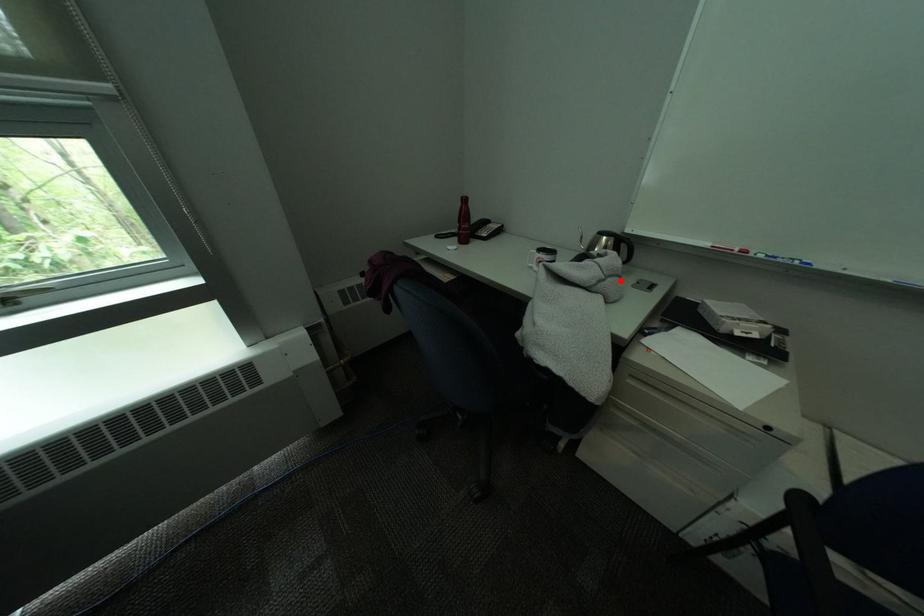
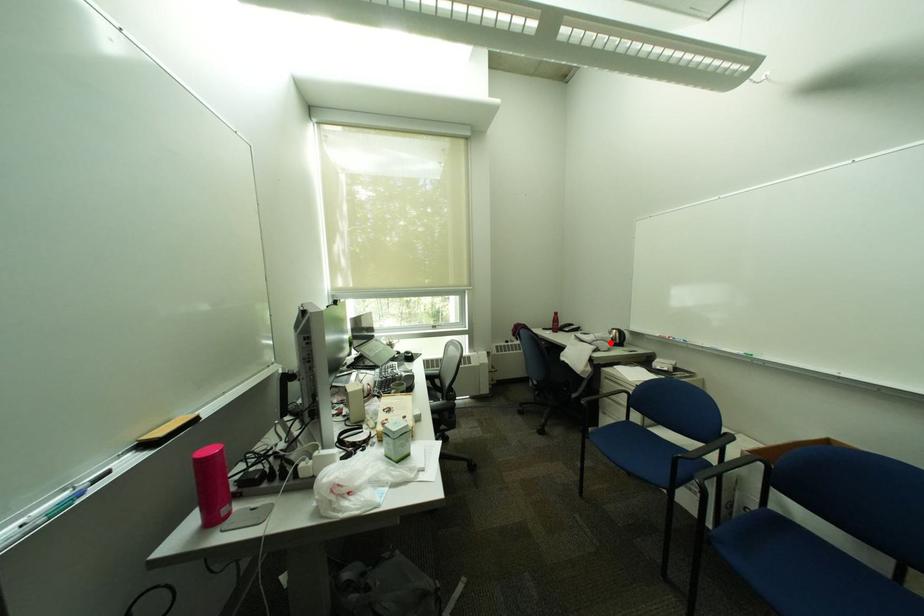
I am providing you with two images of the same scene from different viewpoints. A red point is marked on the first image and another point is marked on the second image. Is the red point in image1 aligned with the point shown in image2?

Yes